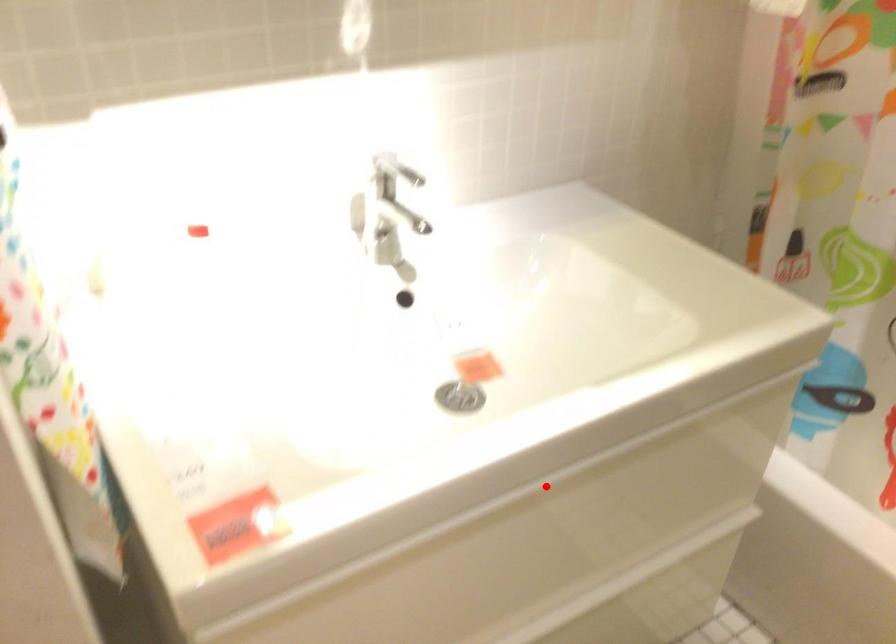
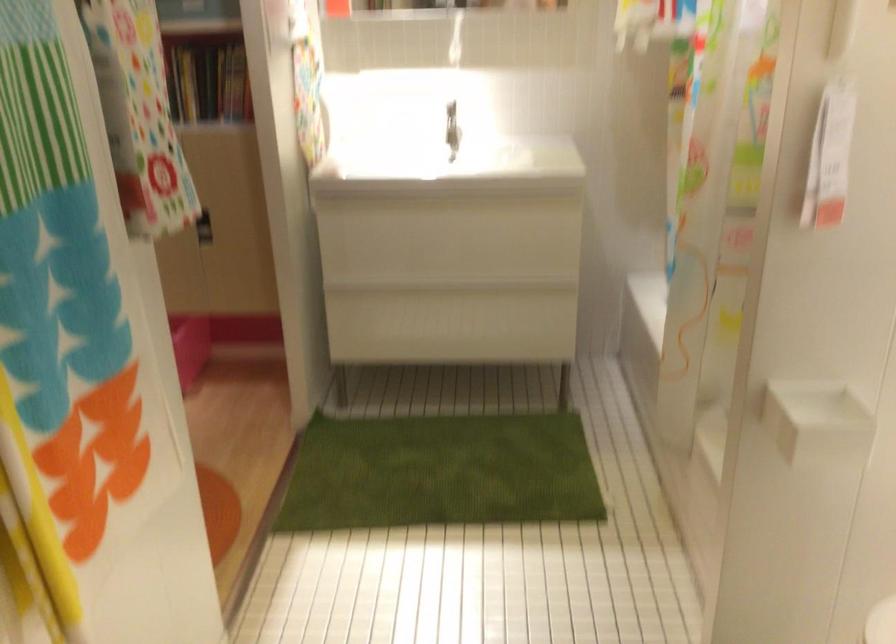
Question: I am providing you with two images of the same scene from different viewpoints. A red point is marked on the first image. Is the red point's position out of view in image 2?

Choices:
 (A) Yes
 (B) No

Answer: (B)